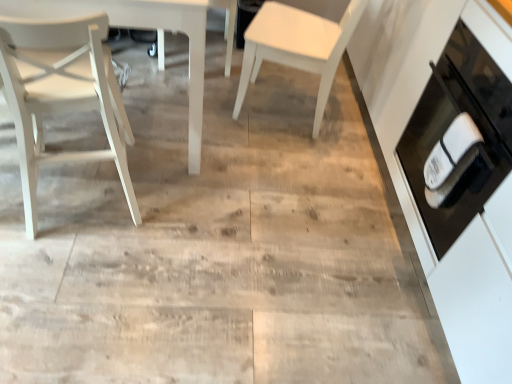
Locate an element on the screen. This screenshot has width=512, height=384. vacant area that is in front of white matte chair at center, the second chair in the left-to-right sequence is located at coordinates (168, 83).